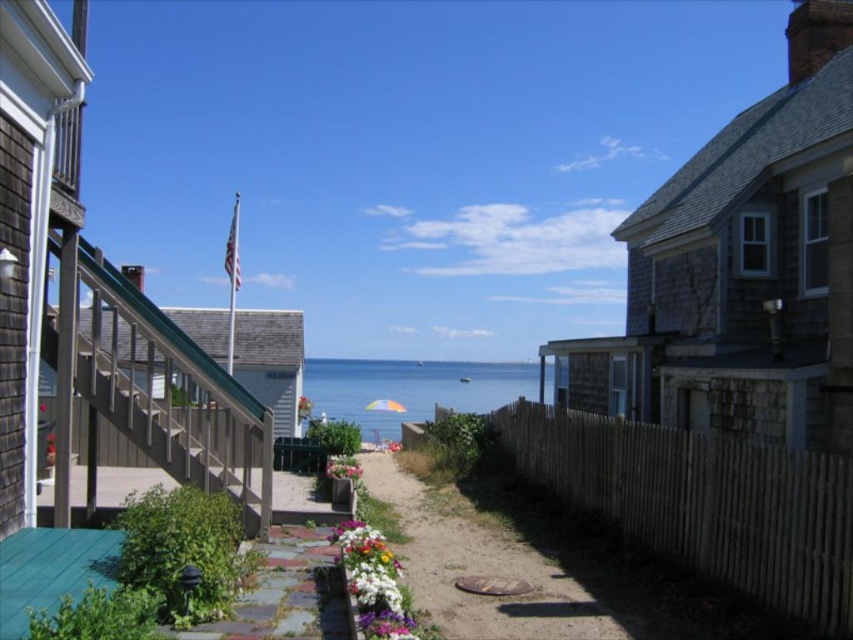
You are standing at the base of the wooden staircase leading to the teal roofed house. You want to place a new bench at point (437, 577). The bench requires a minimum of 30 feet of space behind it for safety. Can you place the bench there?

The distance of point (437, 577) from camera is 28.19 feet, which is less than the required 30 feet. Therefore, placing the bench there would not meet the safety requirement.

You are standing at the base of the stairs leading to the teal roofed house. You want to walk to the beach but need to go around the brown wooden fence at lower right. If you can walk 1.5 meters per second, how many seconds will it take you to reach the fence?

The brown wooden fence at lower right is 6.00 meters away from viewer. At a walking speed of 1.5 meters per second, it would take 4 seconds to reach the fence.